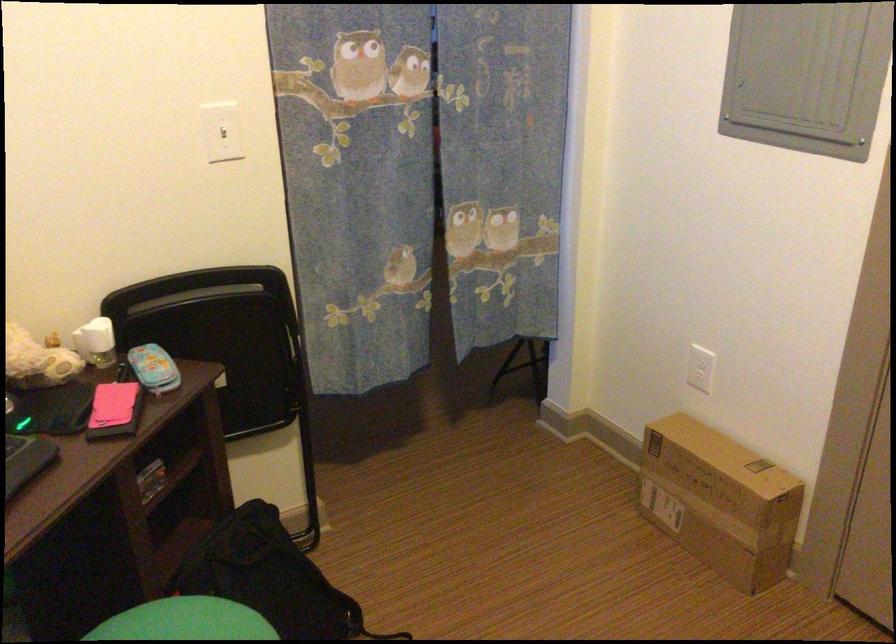
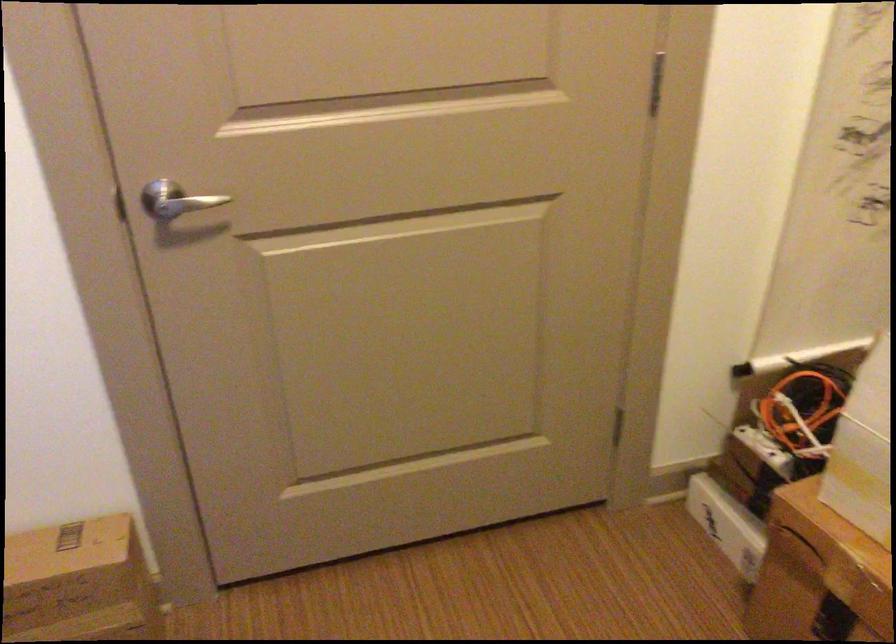
Locate, in the second image, the point that corresponds to point 736,480 in the first image.

(79, 583)